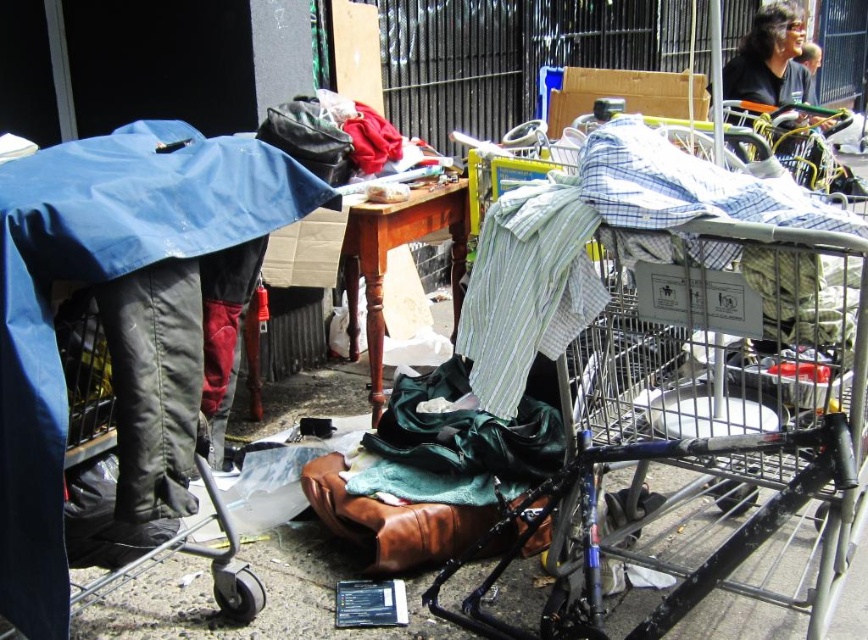
You are standing in this outdoor area and want to place a small box on top of the metallic silver shopping cart at center right. Can you also place another small box on top of the black shirt at upper right? Explain why or why not based on their heights.

The metallic silver shopping cart at center right is taller than the black shirt at upper right. Since the metallic silver shopping cart at center right has greater height, you can place a small box on top of it. However, the black shirt at upper right is shorter, so placing a box on top of it may not be stable or possible due to its lower height.

You are a delivery person trying to load a package into the metallic silver shopping cart at center right and the black shirt at upper right. Which object can the package fit into more easily?

The metallic silver shopping cart at center right has a larger size compared to the black shirt at upper right, so the package can fit more easily into the metallic silver shopping cart at center right.

You are a delivery person who needs to place a package between the metallic silver shopping cart at center right and the black shirt at upper right. Is there enough space to fit a package that is 8 feet long?

The metallic silver shopping cart at center right and black shirt at upper right are 7.79 feet apart. Since the package is 8 feet long, it won not fit between them as the distance is shorter than the package length.